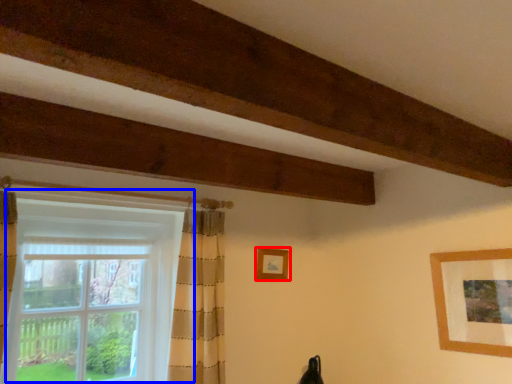
Question: Which object is further to the camera taking this photo, picture frame (highlighted by a red box) or window (highlighted by a blue box)?

Choices:
 (A) picture frame
 (B) window

Answer: (A)